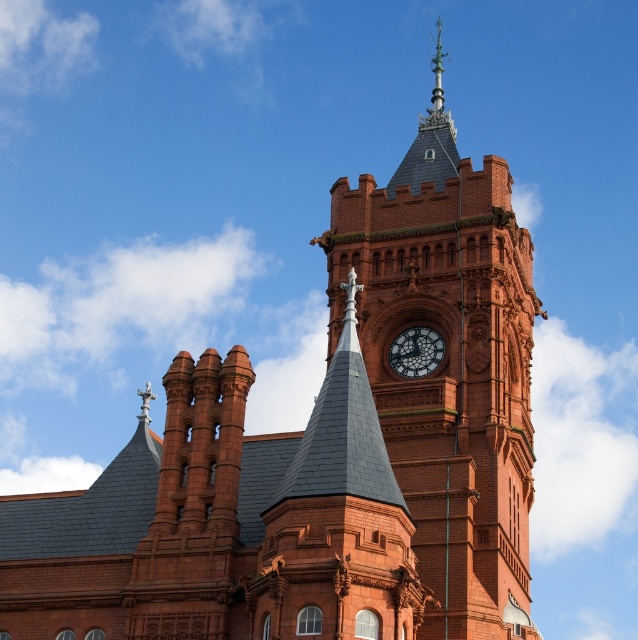
Question: Can you confirm if matte brick clock tower at center is positioned to the left of polished brass clock at center?

Choices:
 (A) yes
 (B) no

Answer: (B)

Question: Can you confirm if matte brick clock tower at center is positioned above polished brass clock at center?

Choices:
 (A) yes
 (B) no

Answer: (A)

Question: Which point is closer to the camera?

Choices:
 (A) polished brass clock at center
 (B) matte brick clock tower at center

Answer: (B)

Question: Is matte brick clock tower at center to the left of polished brass clock at center from the viewer's perspective?

Choices:
 (A) no
 (B) yes

Answer: (A)